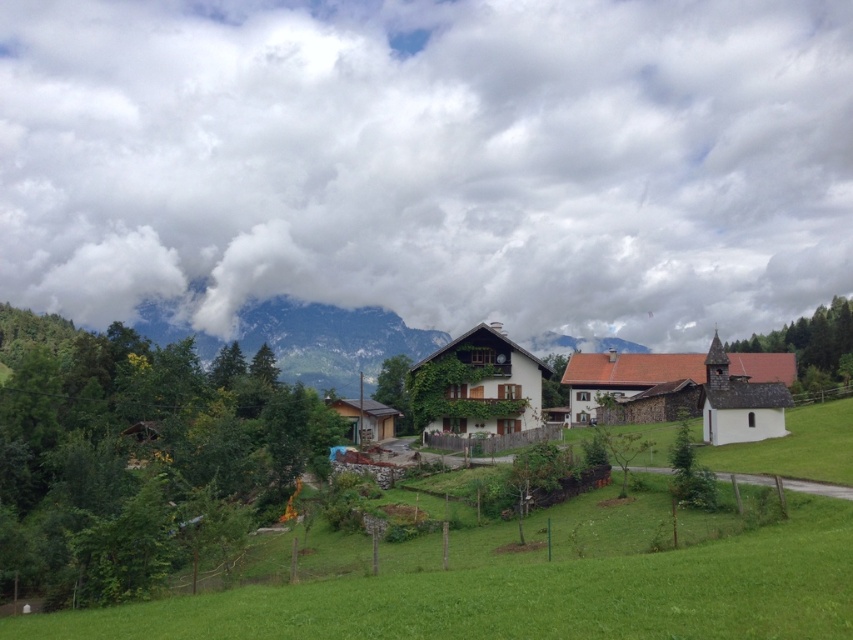
Is point (62, 83) behind point (775, 496)?

Yes.

Can you confirm if white fluffy cloud at upper center is thinner than green grassy field at center?

No, white fluffy cloud at upper center is not thinner than green grassy field at center.

Find the location of `white fluffy cloud at upper center`. white fluffy cloud at upper center is located at coordinates (430, 161).

Does white fluffy cloud at upper center have a lesser width compared to white wooden house at center?

No, white fluffy cloud at upper center is not thinner than white wooden house at center.

Is white fluffy cloud at upper center shorter than white wooden house at center?

No, white fluffy cloud at upper center is not shorter than white wooden house at center.

This screenshot has height=640, width=853. What are the coordinates of `white fluffy cloud at upper center` in the screenshot? It's located at 430,161.

Is green grassy field at center to the right of white wooden house at center from the viewer's perspective?

No, green grassy field at center is not to the right of white wooden house at center.

Is point (488, 548) behind point (775, 394)?

No, it is in front of (775, 394).

Is point (761, 561) farther from camera compared to point (589, 387)?

No, (761, 561) is closer to viewer.

I want to click on green grassy field at center, so click(x=529, y=582).